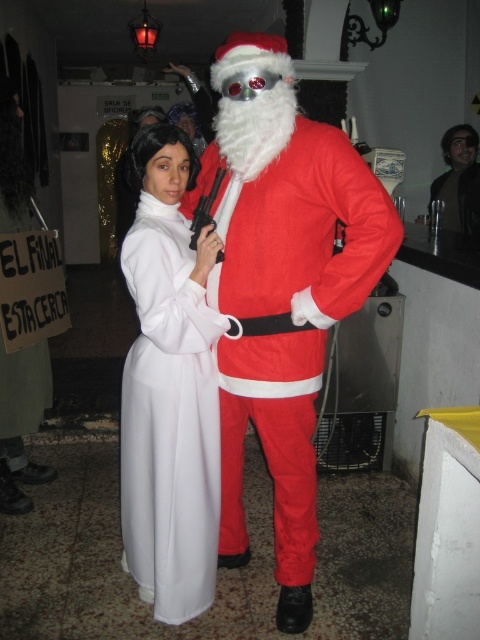
Question: From the image, what is the correct spatial relationship of white satin dress at center in relation to metallic silver gun at center?

Choices:
 (A) below
 (B) above

Answer: (A)

Question: Is smooth black hair at upper right behind metallic silver gun at center?

Choices:
 (A) no
 (B) yes

Answer: (B)

Question: Which point appears farthest from the camera in this image?

Choices:
 (A) (196, 220)
 (B) (172, 516)
 (C) (267, 282)
 (D) (446, 196)

Answer: (D)

Question: Among these points, which one is farthest from the camera?

Choices:
 (A) (264, 228)
 (B) (471, 188)

Answer: (B)

Question: Which object appears farthest from the camera in this image?

Choices:
 (A) metallic silver gun at center
 (B) white satin dress at center

Answer: (A)

Question: In this image, where is velvet red santa suit at center located relative to smooth black hair at upper right?

Choices:
 (A) below
 (B) above

Answer: (A)